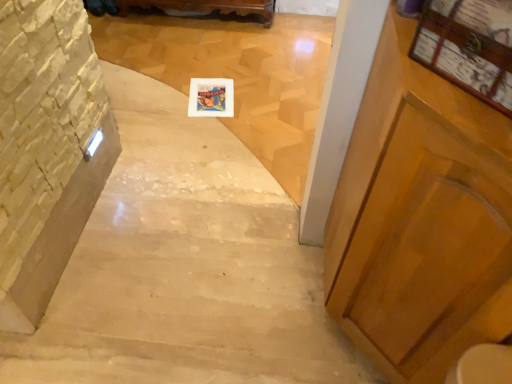
Identify the location of free space above wooden frame at center (from a real-world perspective). This screenshot has height=384, width=512. (213, 92).